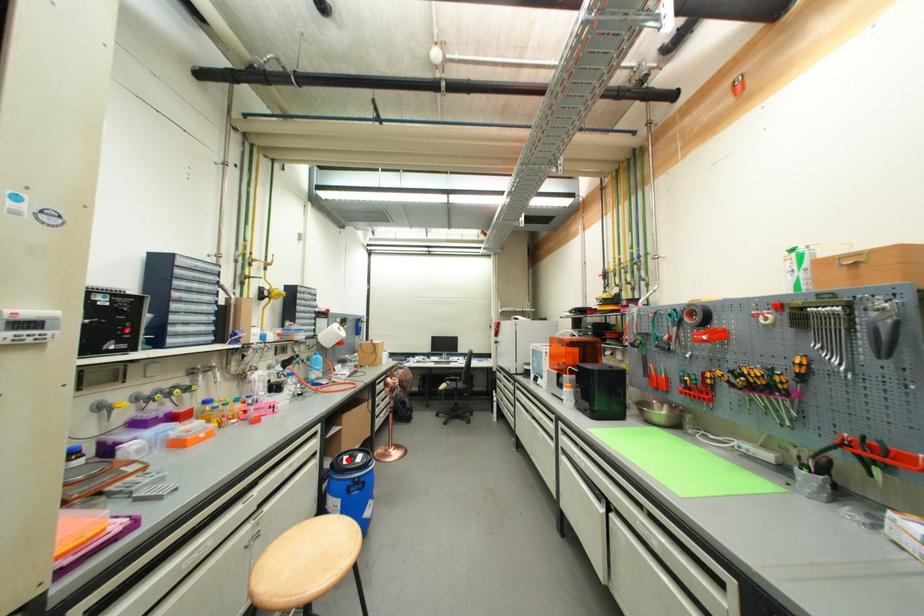
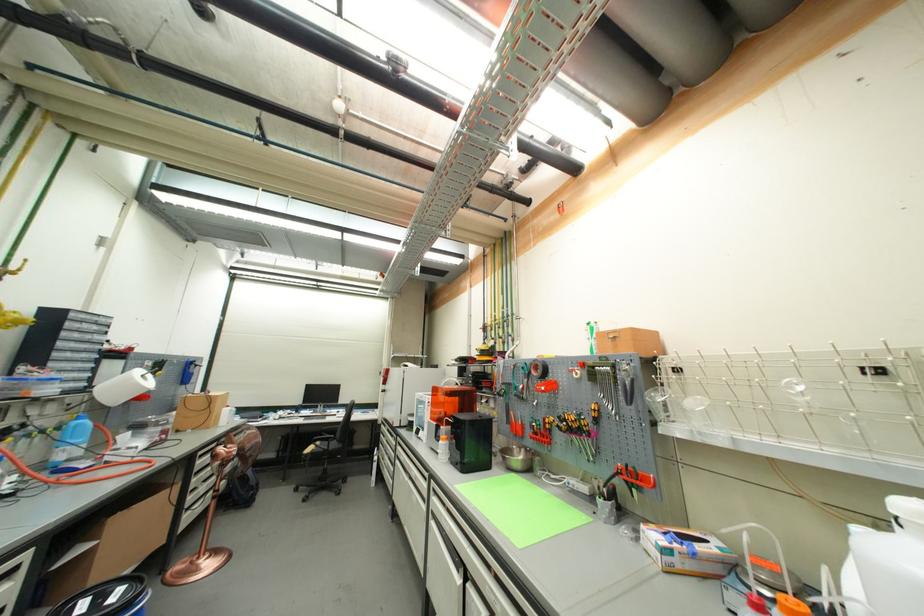
Question: I am providing you with two images of the same scene from different viewpoints. Image1 has a red point marked. In image2, the corresponding 3D location appears at what relative position? Reply with the corresponding letter.

Choices:
 (A) Closer
 (B) Farther

Answer: (B)